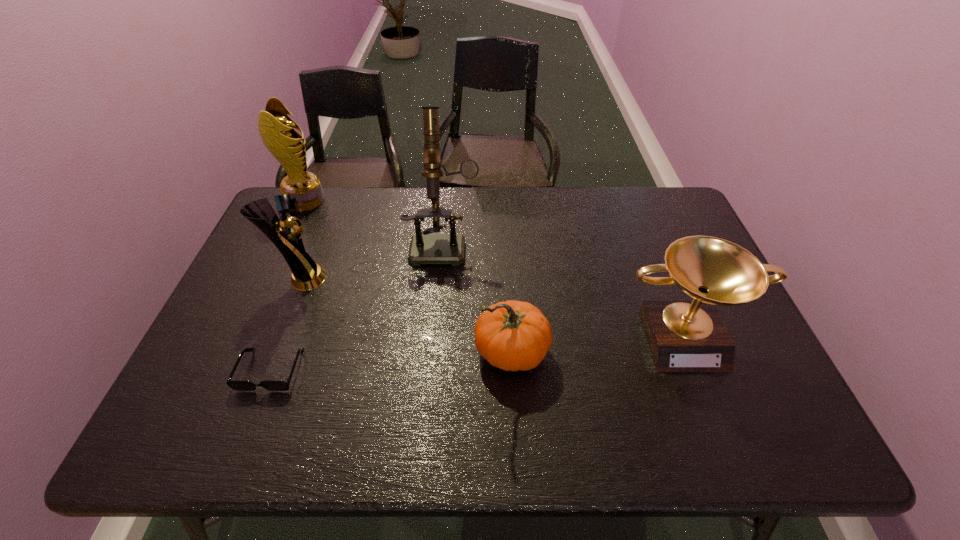
In order to click on vacant space that satisfies the following two spatial constraints: 1. at the eyepiece of the microscope; 2. on the right side of the pumpkin in this screenshot , I will do `click(435, 353)`.

You are a GUI agent. You are given a task and a screenshot of the screen. Output one action in this format:
    pyautogui.click(x=<x>, y=<y>)
    Task: Click on the vacant area in the image that satisfies the following two spatial constraints: 1. at the eyepiece of the microscope; 2. at the front of the second farthest award, where the globe is visible
    This screenshot has width=960, height=540.
    Given the screenshot: What is the action you would take?
    pyautogui.click(x=441, y=279)